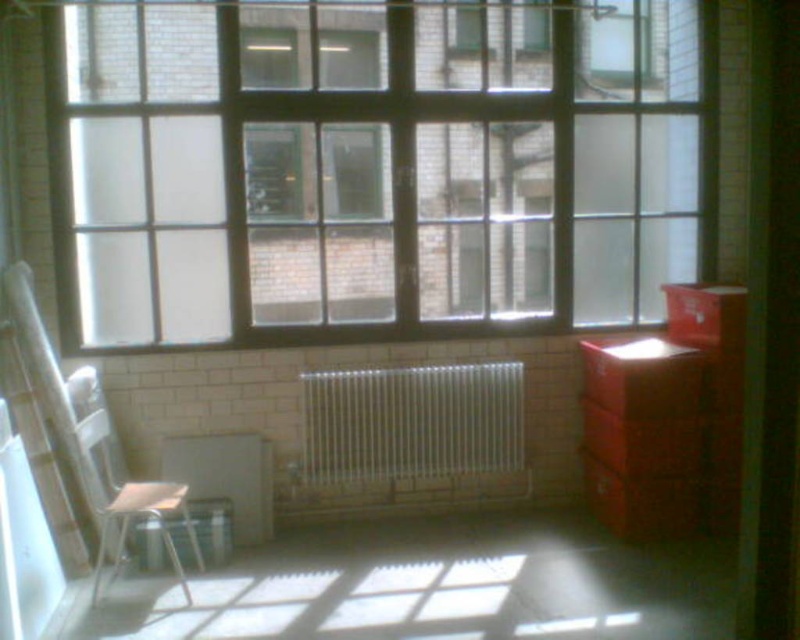
Does white plastic chair at left have a greater height compared to metallic silver stool at lower left?

Indeed, white plastic chair at left has a greater height compared to metallic silver stool at lower left.

Is white plastic chair at left positioned behind metallic silver stool at lower left?

No, it is not.

Measure the distance between white plastic chair at left and camera.

white plastic chair at left is 10.68 feet away from camera.

At what (x,y) coordinates should I click in order to perform the action: click on white plastic chair at left. Please return your answer as a coordinate pair (x, y). The image size is (800, 640). Looking at the image, I should click on (126, 484).

Locate an element on the screen. The image size is (800, 640). clear glass window at center is located at coordinates (380, 164).

Between clear glass window at center and white metallic radiator at center, which one has more height?

clear glass window at center is taller.

Does point (652, 228) come in front of point (486, 401)?

No, (652, 228) is behind (486, 401).

You are a GUI agent. You are given a task and a screenshot of the screen. Output one action in this format:
    pyautogui.click(x=<x>, y=<y>)
    Task: Click on the clear glass window at center
    The image size is (800, 640).
    Given the screenshot: What is the action you would take?
    pyautogui.click(x=380, y=164)

Can you confirm if white metallic radiator at center is smaller than metallic silver stool at lower left?

Actually, white metallic radiator at center might be larger than metallic silver stool at lower left.

Is white metallic radiator at center behind metallic silver stool at lower left?

Yes, it is behind metallic silver stool at lower left.

Between point (494, 461) and point (214, 516), which one is positioned in front?

Point (214, 516) is more forward.

Where is `white metallic radiator at center`? This screenshot has height=640, width=800. white metallic radiator at center is located at coordinates (412, 420).